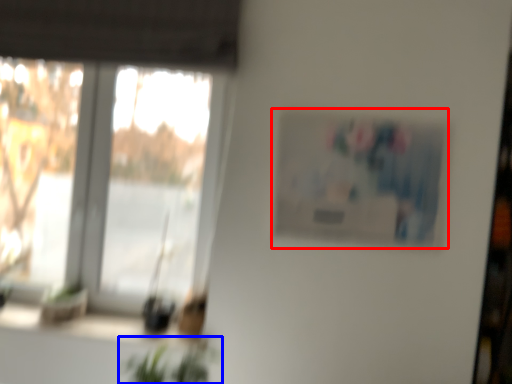
Question: Which of the following is the farthest to the observer, picture frame (highlighted by a red box) or houseplant (highlighted by a blue box)?

Choices:
 (A) picture frame
 (B) houseplant

Answer: (A)